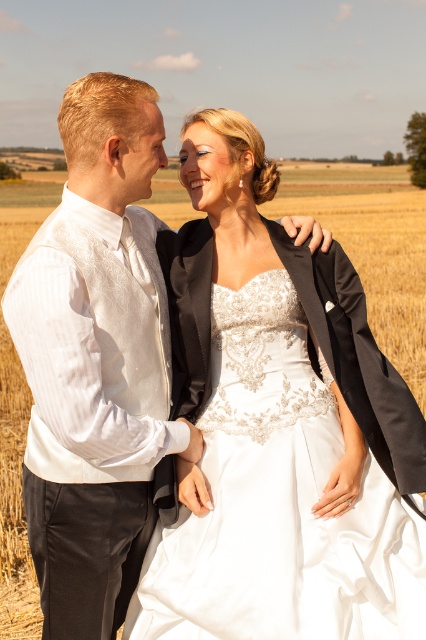
Question: Does white textured vest at left appear on the left side of satin/embroidered dress at center?

Choices:
 (A) no
 (B) yes

Answer: (B)

Question: Is white textured vest at left below satin/embroidered dress at center?

Choices:
 (A) yes
 (B) no

Answer: (B)

Question: Considering the relative positions of white textured vest at left and satin/embroidered dress at center in the image provided, where is white textured vest at left located with respect to satin/embroidered dress at center?

Choices:
 (A) below
 (B) above

Answer: (B)

Question: Which object appears closest to the camera in this image?

Choices:
 (A) white textured vest at left
 (B) satin/embroidered dress at center

Answer: (A)